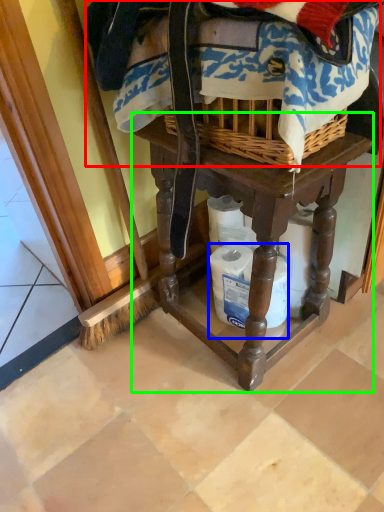
Question: Which object is positioned closest to clothing (highlighted by a red box)? Select from toilet paper (highlighted by a blue box) and furniture (highlighted by a green box).

Choices:
 (A) toilet paper
 (B) furniture

Answer: (B)